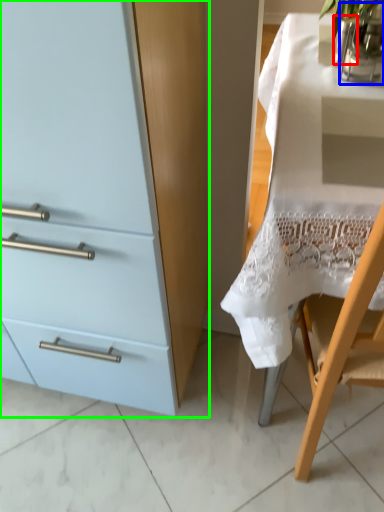
Question: Which object is the closest to the glass vase (highlighted by a red box)? Choose among these: glass vase (highlighted by a blue box) or cabinetry (highlighted by a green box).

Choices:
 (A) glass vase
 (B) cabinetry

Answer: (A)